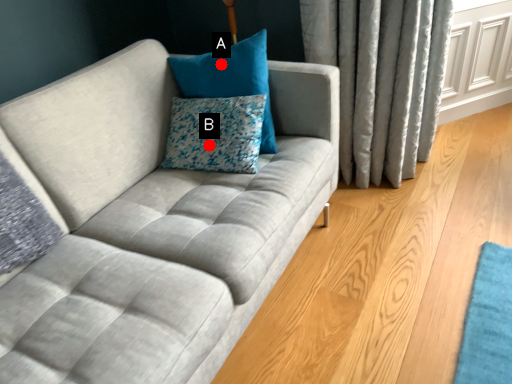
Question: Two points are circled on the image, labeled by A and B beside each circle. Among these points, which one is farthest from the camera?

Choices:
 (A) A is further
 (B) B is further

Answer: (A)